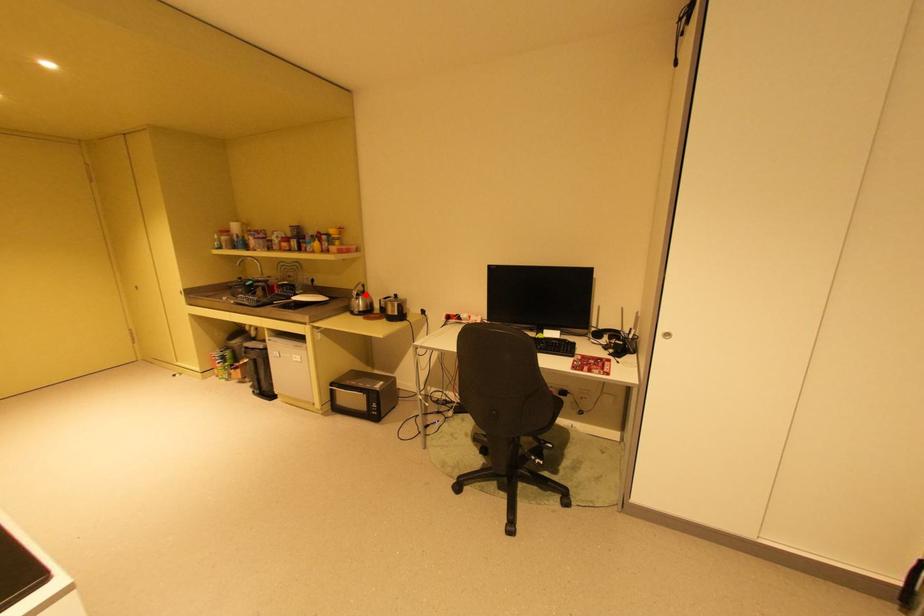
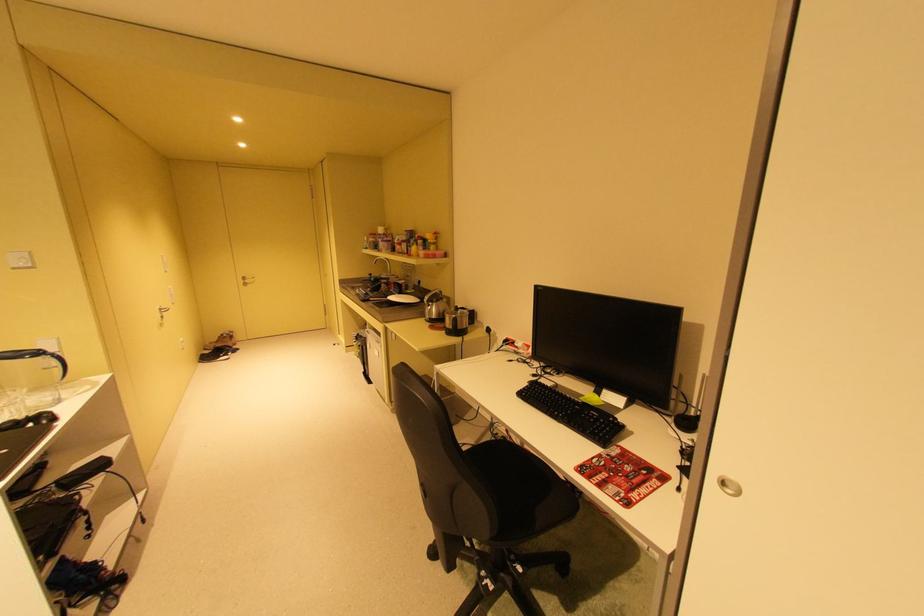
Locate, in the second image, the point that corresponds to the highlighted location in the first image.

(439, 302)